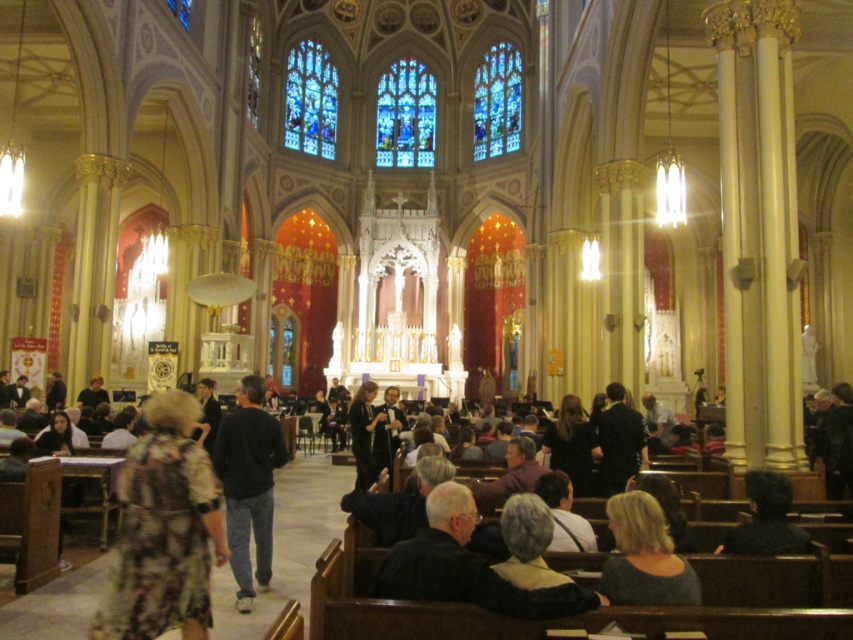
You are standing at the entrance of the church and see two points marked in the image. One is at point (215, 451) and the other at point (718, 547). Which point is closer to you?

Point (215, 451) is further to the camera than point (718, 547), so the point closer to you is point (718, 547).